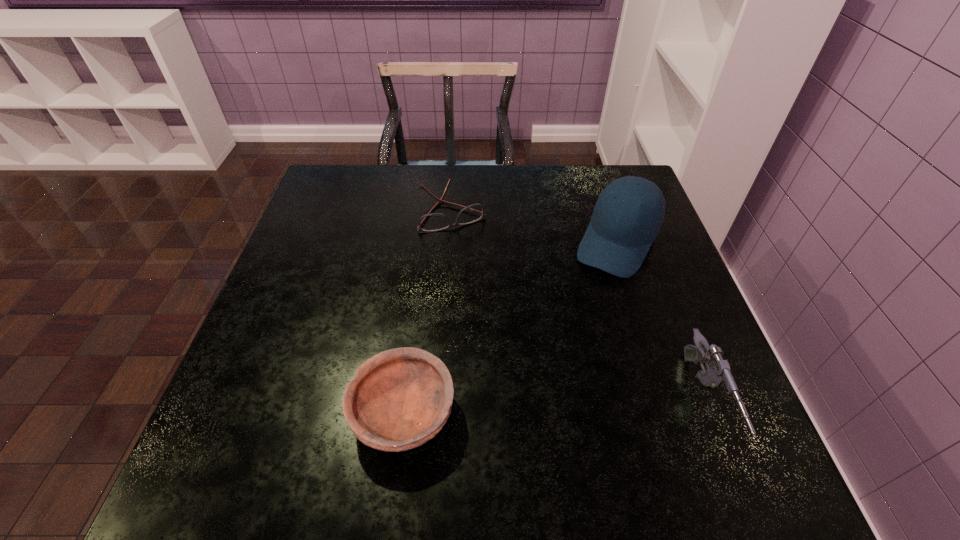
The height and width of the screenshot is (540, 960). What are the coordinates of `free space located 0.280m on the front-facing side of the spectacles` in the screenshot? It's located at (501, 309).

The image size is (960, 540). Find the location of `baseball cap positioned at the far edge`. baseball cap positioned at the far edge is located at coordinates (629, 212).

This screenshot has height=540, width=960. In order to click on spectacles that is at the far edge in this screenshot , I will do `click(431, 222)`.

You are a GUI agent. You are given a task and a screenshot of the screen. Output one action in this format:
    pyautogui.click(x=<x>, y=<y>)
    Task: Click on the bowl that is at the near edge
    Image resolution: width=960 pixels, height=540 pixels.
    Given the screenshot: What is the action you would take?
    pyautogui.click(x=401, y=398)

Find the location of a particular element. The width and height of the screenshot is (960, 540). gun at the near edge is located at coordinates (717, 374).

This screenshot has height=540, width=960. I want to click on gun that is at the right edge, so click(717, 374).

Locate an element on the screen. Image resolution: width=960 pixels, height=540 pixels. baseball cap that is at the right edge is located at coordinates (629, 212).

Locate an element on the screen. The width and height of the screenshot is (960, 540). object at the far right corner is located at coordinates (629, 212).

What are the coordinates of `object present at the near right corner` in the screenshot? It's located at (717, 374).

Identify the location of vacant area at the far edge of the desktop. pyautogui.click(x=385, y=184).